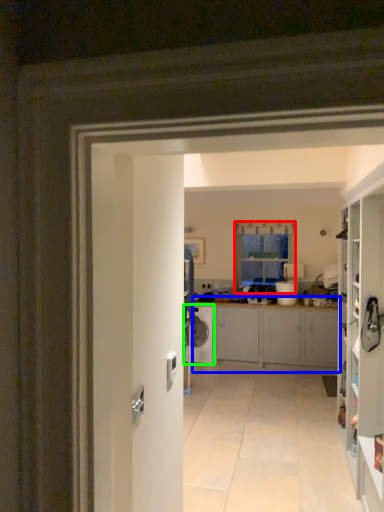
Question: Which object is positioned closest to window (highlighted by a red box)? Select from cabinetry (highlighted by a blue box) and washing machine (highlighted by a green box).

Choices:
 (A) cabinetry
 (B) washing machine

Answer: (A)